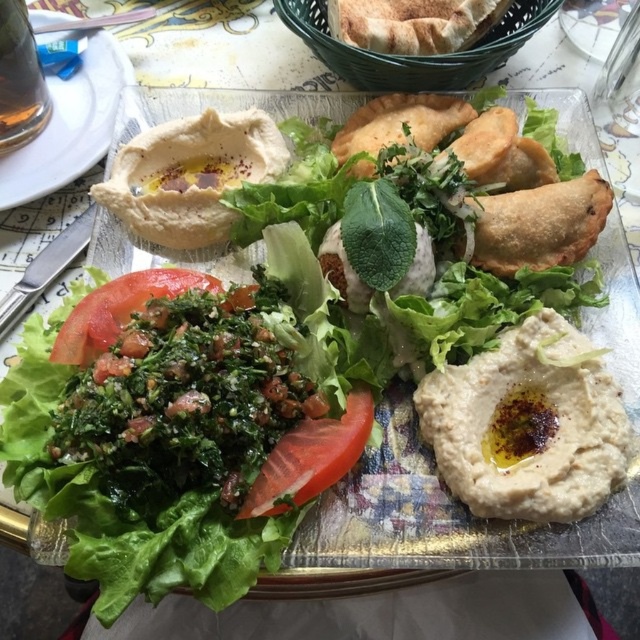
You are a customer at a Middle Eastern restaurant and you want to know if the red matte tomato at center can fit into the transparent glass at upper left. Can you determine this based on their sizes?

The red matte tomato at center is smaller than the transparent glass at upper left, so it can fit inside the transparent glass at upper left.

You are a customer at the restaurant and notice two points on your plate. One is at coordinate point (280, 372) and the other is at coordinate point (58, 177). Which point is closer to you when looking at the plate?

Point (280, 372) is in front of point (58, 177), so it is closer to you when looking at the plate.